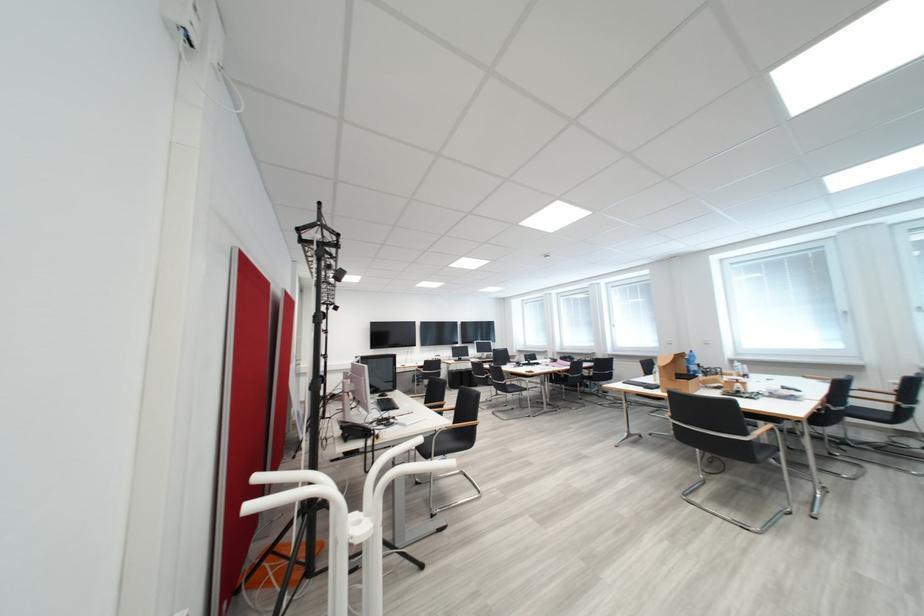
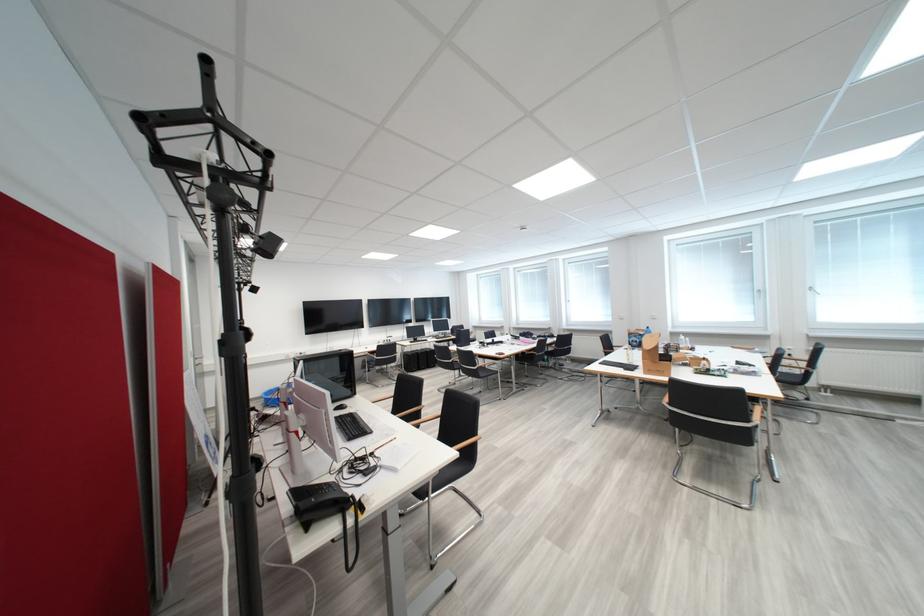
The point at (397,407) is marked in the first image. Where is the corresponding point in the second image?

(365, 430)